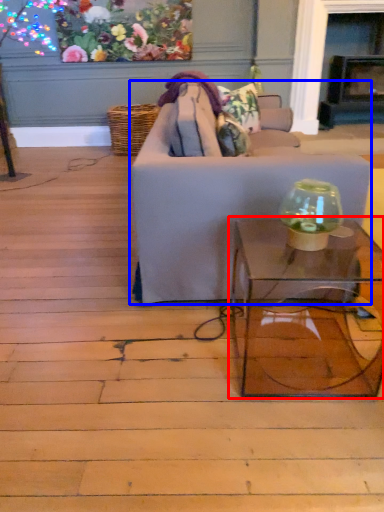
Question: Among these objects, which one is nearest to the camera, table (highlighted by a red box) or studio couch (highlighted by a blue box)?

Choices:
 (A) table
 (B) studio couch

Answer: (A)